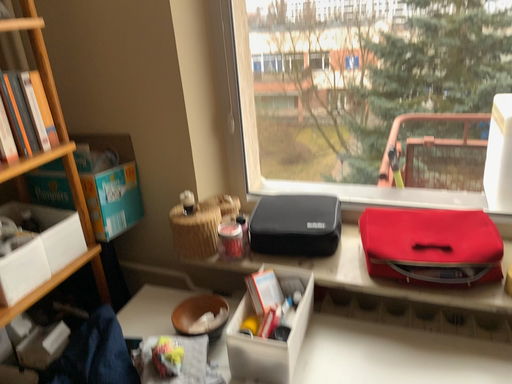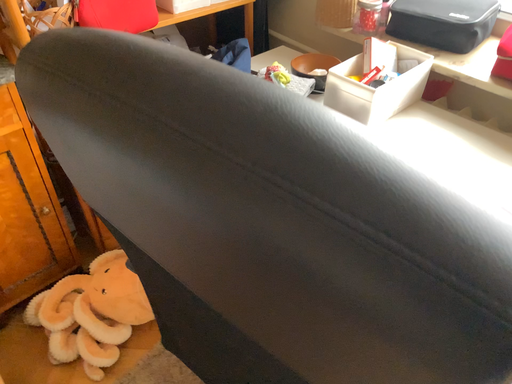
Question: How did the camera likely rotate when shooting the video?

Choices:
 (A) rotated left
 (B) rotated right

Answer: (A)